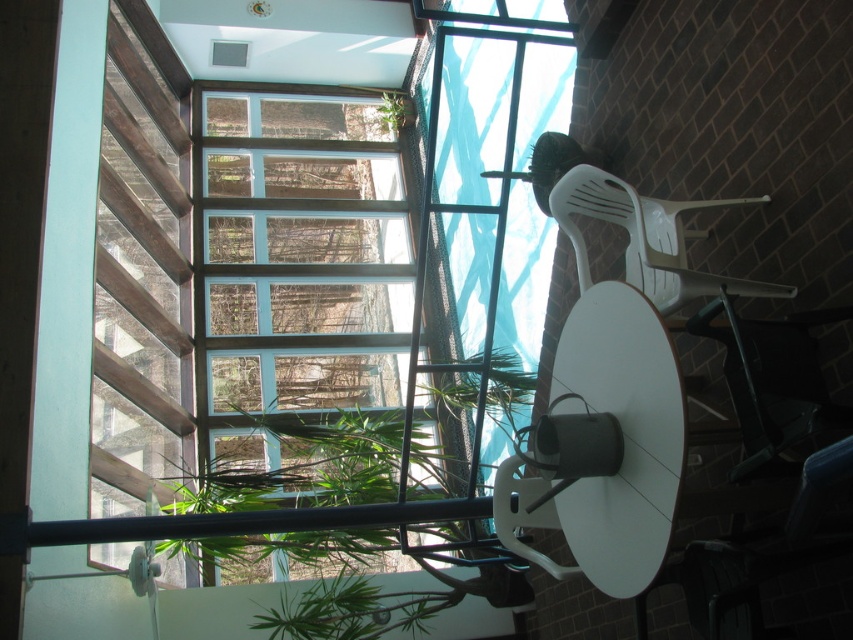
Question: Which point appears closest to the camera in this image?

Choices:
 (A) (102, 125)
 (B) (381, 124)
 (C) (244, 134)

Answer: (A)

Question: Does clear glass window at center appear on the right side of wooden slats at left?

Choices:
 (A) yes
 (B) no

Answer: (A)

Question: Is clear glass window at center wider than green leafy plant at upper center?

Choices:
 (A) yes
 (B) no

Answer: (A)

Question: Which point is closer to the camera?

Choices:
 (A) (287, 321)
 (B) (397, 106)
 (C) (180, 163)

Answer: (A)

Question: Does clear glass window at center appear under green leafy plant at upper center?

Choices:
 (A) no
 (B) yes

Answer: (B)

Question: Considering the real-world distances, which object is closest to the green leafy plant at upper center?

Choices:
 (A) clear glass window at center
 (B) wooden slats at left

Answer: (A)